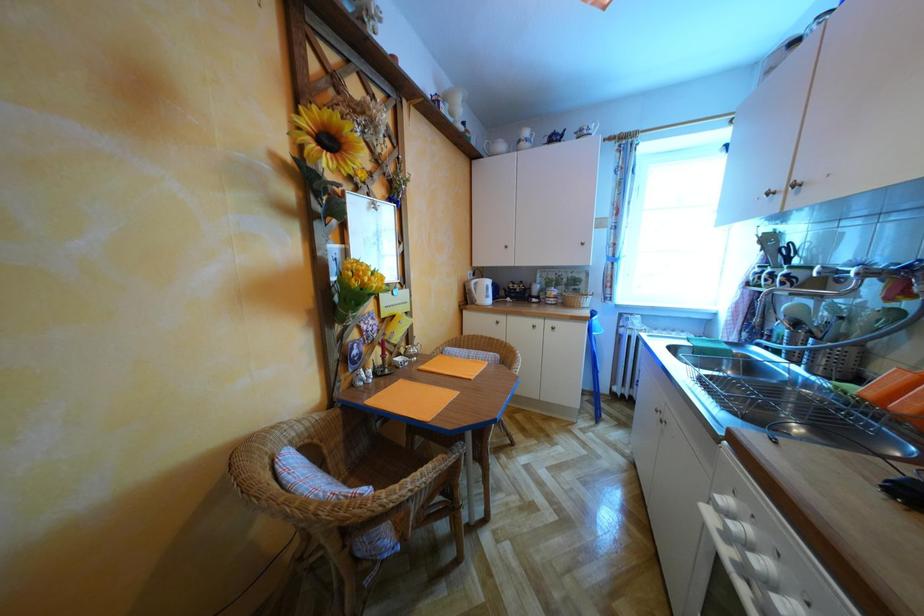
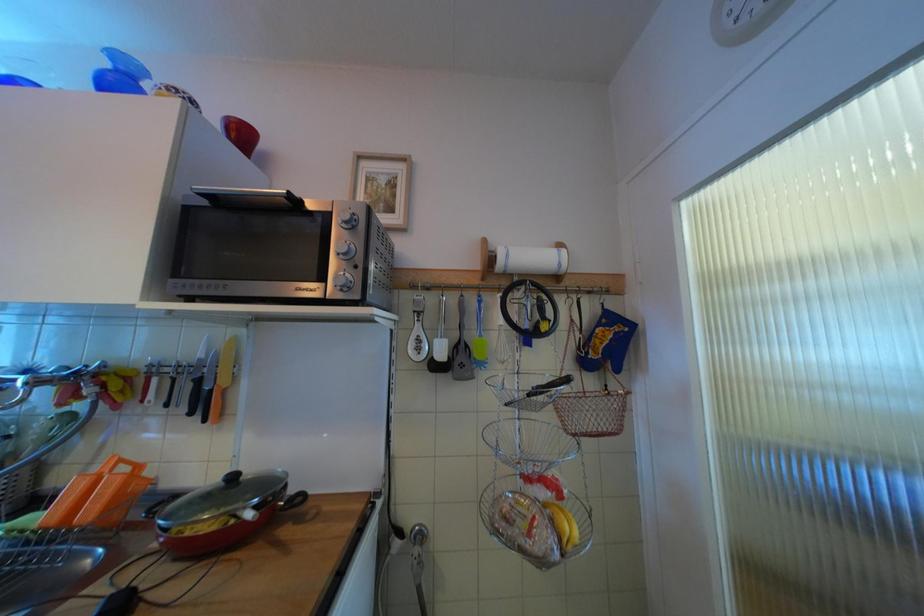
Question: The camera is either moving clockwise (left) or counter-clockwise (right) around the object. The first image is from the beginning of the video and the second image is from the end. Is the camera moving left or right when shooting the video?

Choices:
 (A) Left
 (B) Right

Answer: (A)